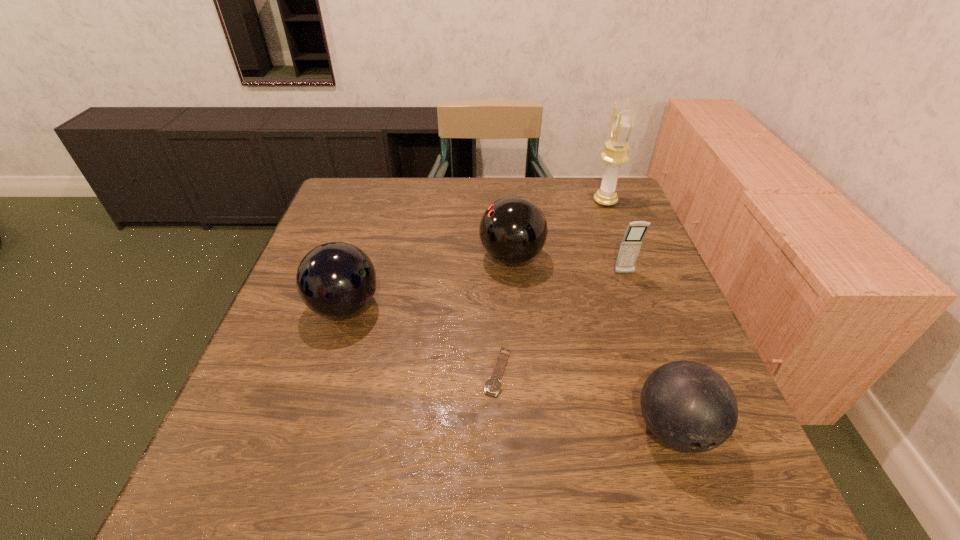
Where is `empty location between the leftmost object and the cellular telephone`? The height and width of the screenshot is (540, 960). empty location between the leftmost object and the cellular telephone is located at coordinates (485, 290).

You are a GUI agent. You are given a task and a screenshot of the screen. Output one action in this format:
    pyautogui.click(x=<x>, y=<y>)
    Task: Click on the vacant area that lies between the farthest bowling ball and the shortest object
    The width and height of the screenshot is (960, 540).
    Given the screenshot: What is the action you would take?
    pyautogui.click(x=505, y=314)

The height and width of the screenshot is (540, 960). In order to click on object that is the fifth closest to the cellular telephone in this screenshot , I will do `click(335, 279)`.

Identify which object is the second nearest to the cellular telephone. Please provide its 2D coordinates. Your answer should be formatted as a tuple, i.e. [(x, y)], where the tuple contains the x and y coordinates of a point satisfying the conditions above.

[(622, 121)]

Identify which bowling ball is located as the second nearest to the award. Please provide its 2D coordinates. Your answer should be formatted as a tuple, i.e. [(x, y)], where the tuple contains the x and y coordinates of a point satisfying the conditions above.

[(688, 406)]

Select which bowling ball appears as the second closest to the shortest object. Please provide its 2D coordinates. Your answer should be formatted as a tuple, i.e. [(x, y)], where the tuple contains the x and y coordinates of a point satisfying the conditions above.

[(513, 230)]

Where is `vacant space that satisfies the following two spatial constraints: 1. on the side of the leftmost bowling ball with the finger holes; 2. on the left side of the watch`? vacant space that satisfies the following two spatial constraints: 1. on the side of the leftmost bowling ball with the finger holes; 2. on the left side of the watch is located at coordinates click(x=324, y=372).

Locate an element on the screen. The height and width of the screenshot is (540, 960). free space that satisfies the following two spatial constraints: 1. on the front-facing side of the farthest object; 2. on the grip area of the rightmost bowling ball is located at coordinates (693, 429).

Where is `free space that satisfies the following two spatial constraints: 1. on the front-facing side of the award; 2. on the grip area of the nearest bowling ball`? The width and height of the screenshot is (960, 540). free space that satisfies the following two spatial constraints: 1. on the front-facing side of the award; 2. on the grip area of the nearest bowling ball is located at coordinates (693, 429).

Where is `vacant region that satisfies the following two spatial constraints: 1. on the front-facing side of the cellular telephone; 2. on the side of the leftmost bowling ball with the finger holes`? This screenshot has height=540, width=960. vacant region that satisfies the following two spatial constraints: 1. on the front-facing side of the cellular telephone; 2. on the side of the leftmost bowling ball with the finger holes is located at coordinates (636, 307).